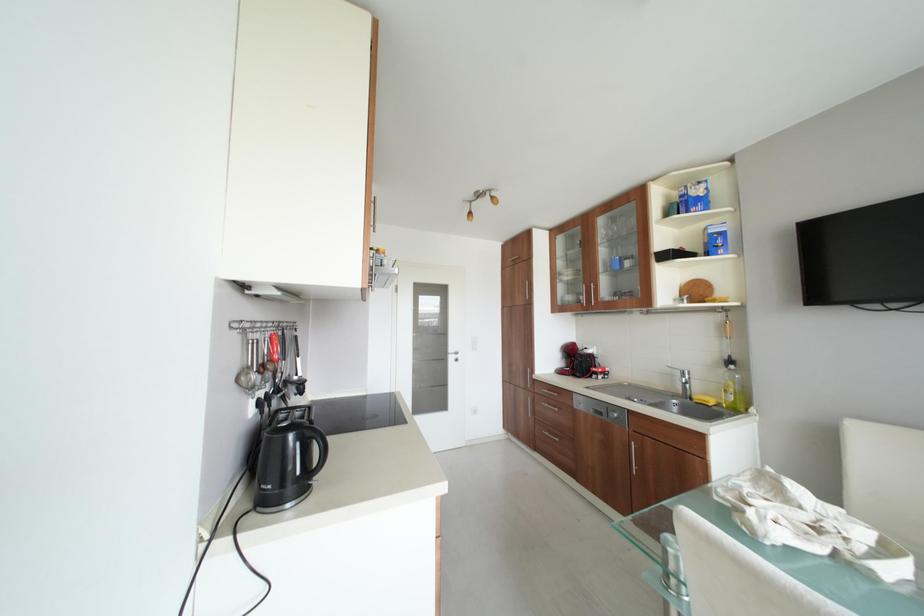
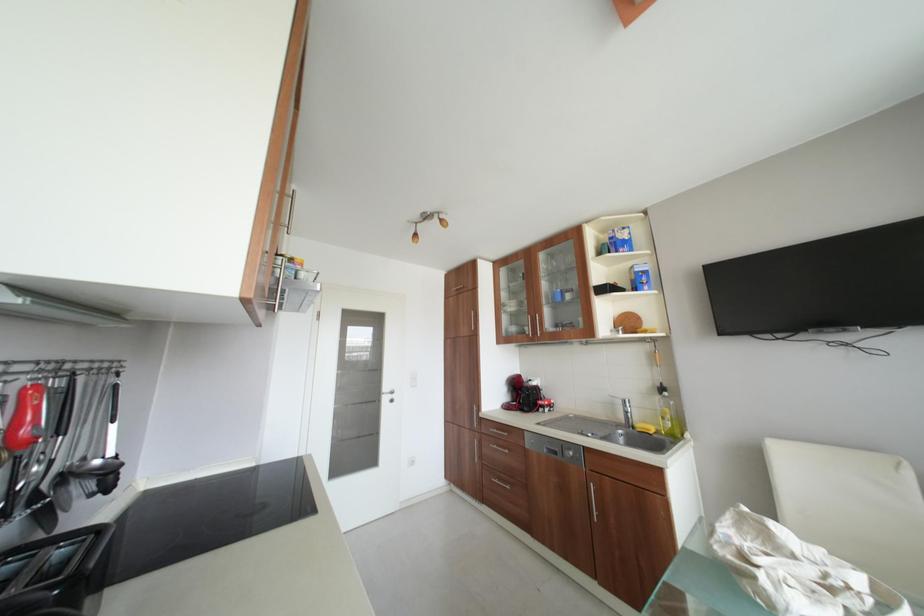
Question: Based on the continuous images, in which direction is the camera rotating? Reply with the corresponding letter.

Choices:
 (A) Left
 (B) Right
 (C) Up
 (D) Down

Answer: (B)